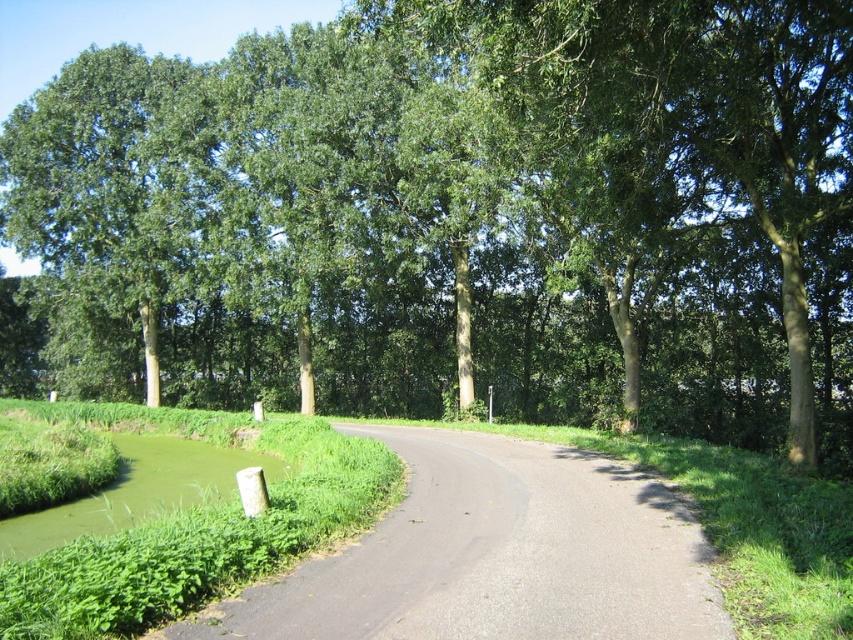
Which is more to the left, green leafy tree at center or green grassy bank at lower left?

Positioned to the left is green leafy tree at center.

I want to click on green leafy tree at center, so click(462, 216).

Does green leafy tree at center have a greater height compared to black asphalt road at center?

Indeed, green leafy tree at center has a greater height compared to black asphalt road at center.

Which is above, green leafy tree at center or black asphalt road at center?

green leafy tree at center is higher up.

Who is more forward, (x=442, y=65) or (x=520, y=529)?

Point (x=520, y=529) is in front.

This screenshot has width=853, height=640. I want to click on green leafy tree at center, so click(462, 216).

Is black asphalt road at center closer to the viewer compared to green grassy bank at lower left?

Yes, it is.

Which is in front, point (506, 440) or point (210, 474)?

Point (210, 474) is in front.

Is point (173, 636) positioned after point (175, 444)?

No, (173, 636) is closer to viewer.

You are a GUI agent. You are given a task and a screenshot of the screen. Output one action in this format:
    pyautogui.click(x=<x>, y=<y>)
    Task: Click on the black asphalt road at center
    
    Given the screenshot: What is the action you would take?
    (494, 556)